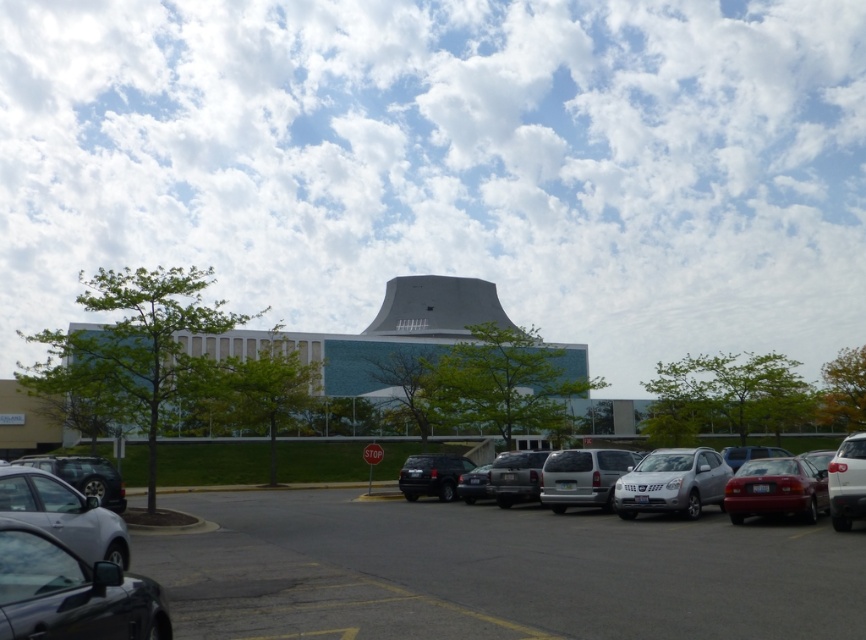
Question: Which object is positioned farthest from the silver metallic van at center?

Choices:
 (A) silver metallic suv at center
 (B) shiny silver suv at right
 (C) silver metallic sedan at lower left
 (D) satin silver suv at center

Answer: (C)

Question: Which of the following is the closest to the observer?

Choices:
 (A) silver metallic van at center
 (B) silver metallic suv at center

Answer: (B)

Question: Can you confirm if silver metallic suv at center is positioned below shiny silver suv at right?

Choices:
 (A) no
 (B) yes

Answer: (B)

Question: Is shiny red sedan at lower right to the right of shiny silver suv at right from the viewer's perspective?

Choices:
 (A) no
 (B) yes

Answer: (A)

Question: Among these objects, which one is nearest to the camera?

Choices:
 (A) satin silver suv at center
 (B) matte black suv at center
 (C) silver metallic suv at center

Answer: (C)

Question: Does shiny red sedan at lower right appear over shiny black suv at lower left?

Choices:
 (A) no
 (B) yes

Answer: (B)